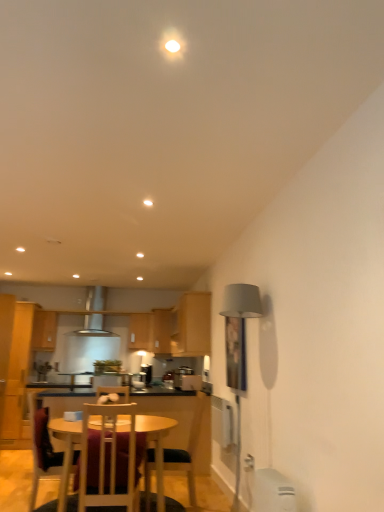
Question: Is wooden cabinet at center, which appears as the second cabinetry when viewed from the right, completely or partially inside satin silver toaster at center, which is counted as the 1th appliance, starting from the back?

Choices:
 (A) yes
 (B) no

Answer: (B)

Question: Is satin silver toaster at center, the second appliance positioned from the front, thinner than wooden cabinet at center, the fourth cabinetry positioned from the front?

Choices:
 (A) no
 (B) yes

Answer: (B)

Question: Considering the relative sizes of satin silver toaster at center, the second appliance positioned from the front, and wooden cabinet at center, the fourth cabinetry positioned from the front, in the image provided, is satin silver toaster at center, the second appliance positioned from the front, taller than wooden cabinet at center, the fourth cabinetry positioned from the front,?

Choices:
 (A) yes
 (B) no

Answer: (B)

Question: Is satin silver toaster at center, which is counted as the 1th appliance, starting from the back, at the left side of wooden cabinet at center, the fourth cabinetry positioned from the front?

Choices:
 (A) no
 (B) yes

Answer: (A)

Question: Is satin silver toaster at center, the second appliance positioned from the front, far away from wooden cabinet at center, the first cabinetry viewed from the back?

Choices:
 (A) no
 (B) yes

Answer: (B)

Question: From a real-world perspective, is satin silver toaster at center, the second appliance positioned from the front, positioned over wooden cabinet at center, which appears as the second cabinetry when viewed from the right, based on gravity?

Choices:
 (A) no
 (B) yes

Answer: (A)

Question: Does satin silver exhaust hood at center have a greater width compared to wooden chair at center, marked as the third chair in a left-to-right arrangement?

Choices:
 (A) no
 (B) yes

Answer: (A)

Question: Is the position of satin silver exhaust hood at center more distant than that of wooden chair at center, marked as the third chair in a left-to-right arrangement?

Choices:
 (A) yes
 (B) no

Answer: (A)

Question: Can you see satin silver exhaust hood at center touching wooden chair at center, marked as the third chair in a left-to-right arrangement?

Choices:
 (A) yes
 (B) no

Answer: (B)

Question: Can you confirm if satin silver exhaust hood at center is thinner than wooden chair at center, marked as the third chair in a left-to-right arrangement?

Choices:
 (A) yes
 (B) no

Answer: (A)

Question: Is satin silver exhaust hood at center outside of wooden chair at center, which is the 1th chair in right-to-left order?

Choices:
 (A) yes
 (B) no

Answer: (A)

Question: Could you tell me if satin silver exhaust hood at center is turned towards wooden chair at center, which is the 1th chair in right-to-left order?

Choices:
 (A) no
 (B) yes

Answer: (B)

Question: Is wooden chair at lower left, the first chair from the left, directly adjacent to wooden chair at center, which is the 1th chair in right-to-left order?

Choices:
 (A) no
 (B) yes

Answer: (A)